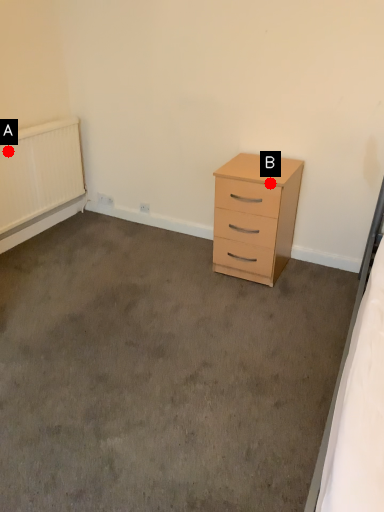
Question: Two points are circled on the image, labeled by A and B beside each circle. Which point is further to the camera?

Choices:
 (A) A is further
 (B) B is further

Answer: (A)